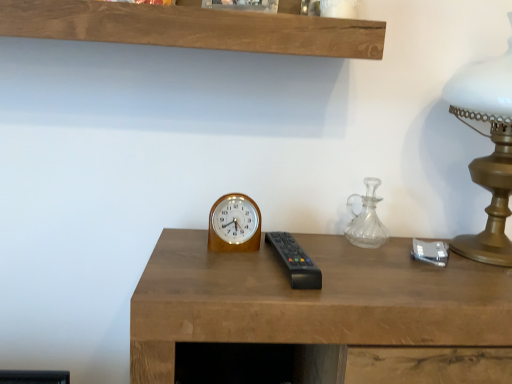
Where is `free space above wooden desk at center (from a real-world perspective)`? The width and height of the screenshot is (512, 384). free space above wooden desk at center (from a real-world perspective) is located at coordinates (341, 260).